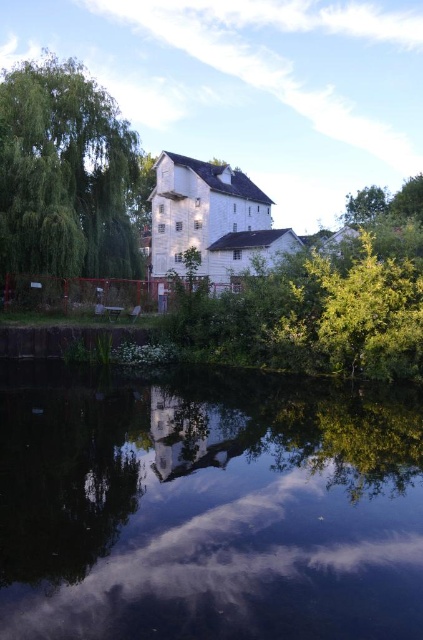
Which of these two, transparent glass lake at center or green leafy tree at upper right, stands shorter?

With less height is transparent glass lake at center.

Which of these two, transparent glass lake at center or green leafy tree at upper right, stands taller?

With more height is green leafy tree at upper right.

Find the location of a particular element. The width and height of the screenshot is (423, 640). transparent glass lake at center is located at coordinates (209, 509).

Where is `transparent glass lake at center`? transparent glass lake at center is located at coordinates (209, 509).

Does transparent glass lake at center appear on the left side of green leafy tree at left?

In fact, transparent glass lake at center is to the right of green leafy tree at left.

Is transparent glass lake at center above green leafy tree at left?

No, transparent glass lake at center is not above green leafy tree at left.

Who is more distant from viewer, (5, 593) or (74, 131)?

Point (74, 131)

The width and height of the screenshot is (423, 640). In order to click on transparent glass lake at center in this screenshot , I will do `click(209, 509)`.

Can you confirm if green leafy tree at left is smaller than green leafy tree at upper right?

Correct, green leafy tree at left occupies less space than green leafy tree at upper right.

Does green leafy tree at left appear on the right side of green leafy tree at upper right?

Incorrect, green leafy tree at left is not on the right side of green leafy tree at upper right.

What do you see at coordinates (65, 173) in the screenshot?
I see `green leafy tree at left` at bounding box center [65, 173].

Find the location of a particular element. green leafy tree at left is located at coordinates (x=65, y=173).